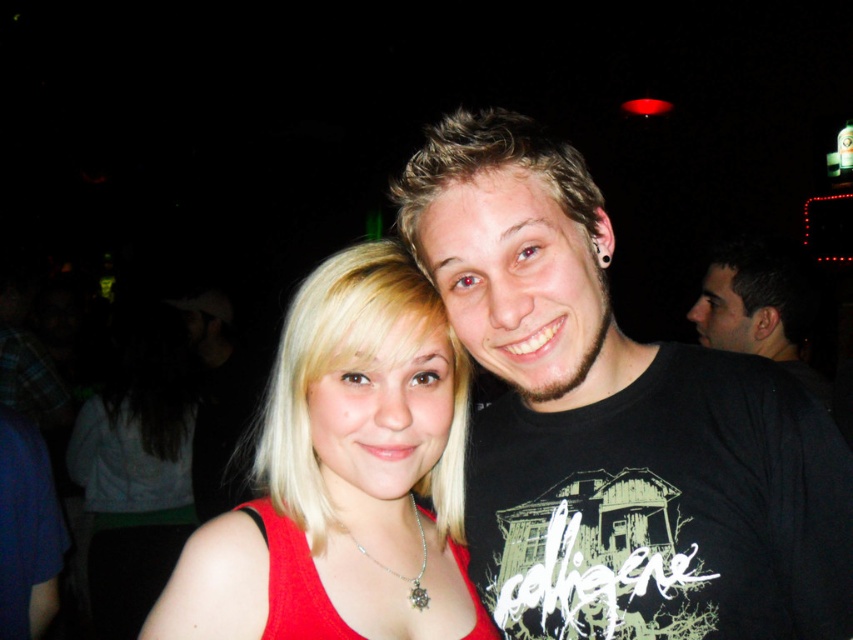
Is black t-shirt at center behind red fabric dress at center?

No, it is in front of red fabric dress at center.

Who is shorter, black t-shirt at center or red fabric dress at center?

red fabric dress at center

This screenshot has height=640, width=853. What are the coordinates of `black t-shirt at center` in the screenshot? It's located at (614, 422).

Which is in front, point (654, 566) or point (315, 330)?

Point (315, 330) is more forward.

In the scene shown: Is black t-shirt at center bigger than matte red tank top at center?

Yes.

Who is more distant from viewer, (840, 438) or (291, 381)?

The point (291, 381) is more distant.

Find the location of a particular element. black t-shirt at center is located at coordinates (614, 422).

Is matte red tank top at center to the right of red fabric dress at center from the viewer's perspective?

In fact, matte red tank top at center is to the left of red fabric dress at center.

Is matte red tank top at center thinner than red fabric dress at center?

→ No, matte red tank top at center is not thinner than red fabric dress at center.

Does point (397, 252) come in front of point (286, 538)?

No, (397, 252) is behind (286, 538).

You are a GUI agent. You are given a task and a screenshot of the screen. Output one action in this format:
    pyautogui.click(x=<x>, y=<y>)
    Task: Click on the matte red tank top at center
    This screenshot has width=853, height=640.
    Given the screenshot: What is the action you would take?
    pyautogui.click(x=345, y=476)